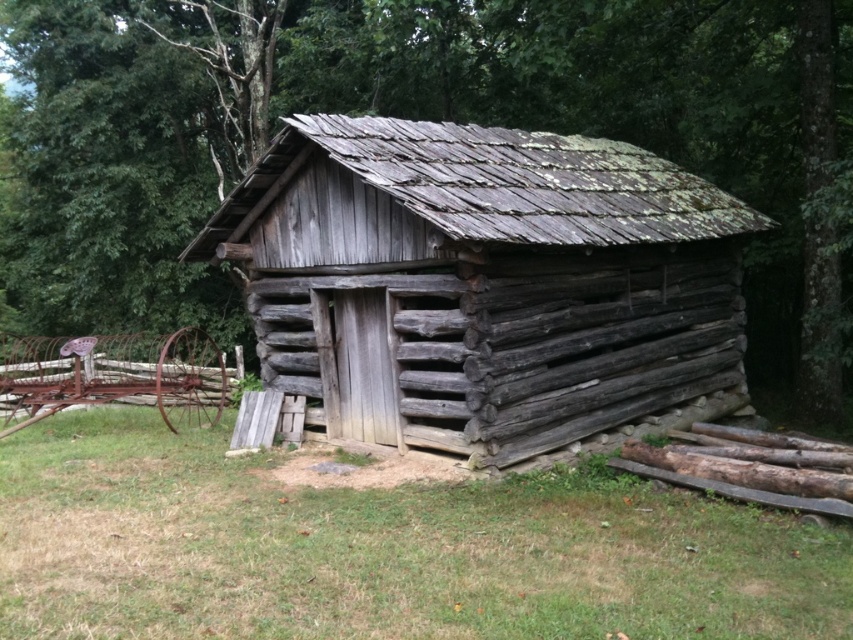
You are standing in the forest and see the weathered wood log cabin at center and the green grass at lower center. Which object is closer to you?

The weathered wood log cabin at center is closer to you than the green grass at lower center because it is positioned further to the viewer.

You are standing at a distance from the weathered wood log cabin at center and want to take a photo of it with your camera. If the recommended distance for clear photography is 20 feet, is the current distance sufficient?

The distance between you and the weathered wood log cabin at center is 23.10 feet, which exceeds the recommended 20 feet. Therefore, the current distance is sufficient for clear photography.

You are a hiker standing at the edge of the forest. You see the weathered wood log cabin at center and the green grass at lower center. Which object is higher in elevation?

The weathered wood log cabin at center is located above green grass at lower center, so the cabin is higher in elevation than the grass.